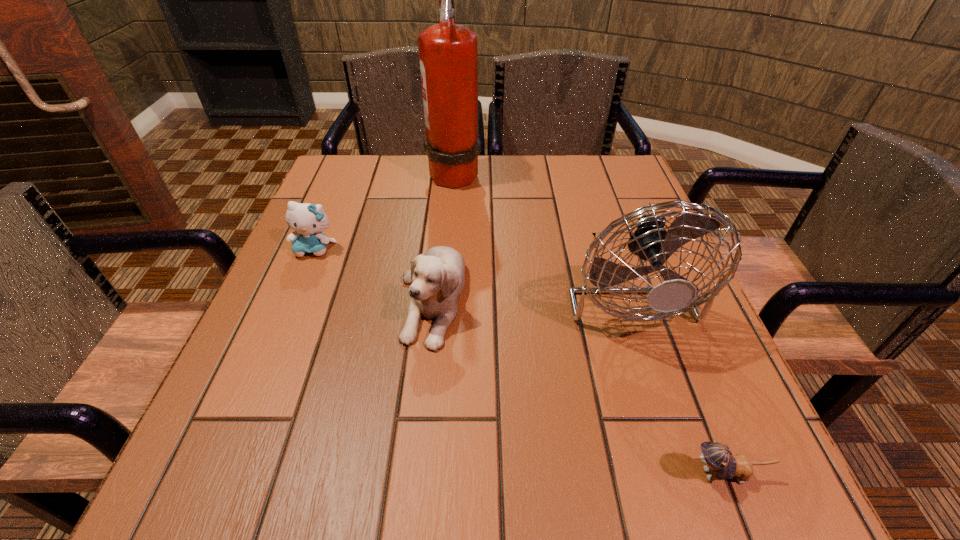
Find the location of a particular element. Image resolution: width=960 pixels, height=540 pixels. object located in the near right corner section of the desktop is located at coordinates (718, 459).

In the image, there is a desktop. Where is `vacant space at the far edge`? The width and height of the screenshot is (960, 540). vacant space at the far edge is located at coordinates (463, 195).

Image resolution: width=960 pixels, height=540 pixels. Find the location of `vacant area at the near edge of the desktop`. vacant area at the near edge of the desktop is located at coordinates (478, 466).

Image resolution: width=960 pixels, height=540 pixels. In the image, there is a desktop. What are the coordinates of `free space at the left edge` in the screenshot? It's located at (293, 337).

The width and height of the screenshot is (960, 540). In order to click on vacant space at the right edge in this screenshot , I will do `click(732, 415)`.

Locate an element on the screen. The height and width of the screenshot is (540, 960). vacant region at the far left corner of the desktop is located at coordinates (342, 159).

This screenshot has width=960, height=540. What are the coordinates of `free space at the far right corner` in the screenshot? It's located at (616, 193).

Where is `blank space at the near right corner of the desktop`? This screenshot has height=540, width=960. blank space at the near right corner of the desktop is located at coordinates (690, 448).

This screenshot has height=540, width=960. I want to click on free area in between the taller kitten and the puppy, so click(x=373, y=274).

Identify the location of free space between the leftmost object and the fourth shortest object. (469, 267).